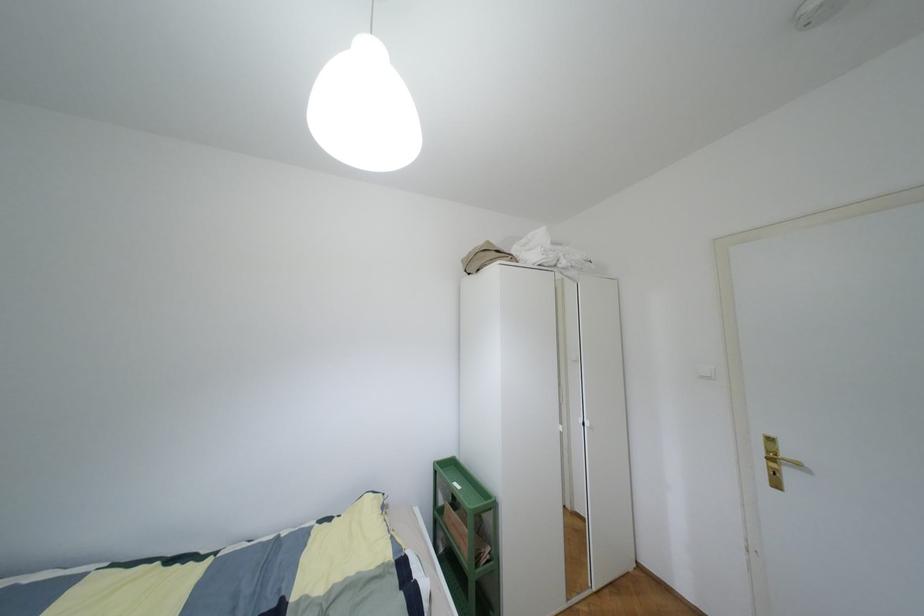
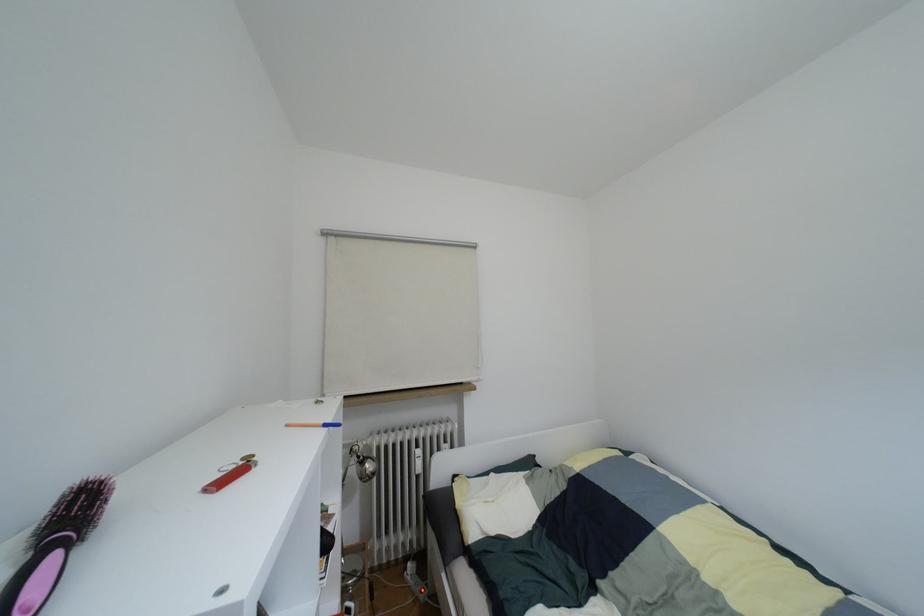
Question: The first image is from the beginning of the video and the second image is from the end. How did the camera likely rotate when shooting the video?

Choices:
 (A) Left
 (B) Right
 (C) Up
 (D) Down

Answer: (A)